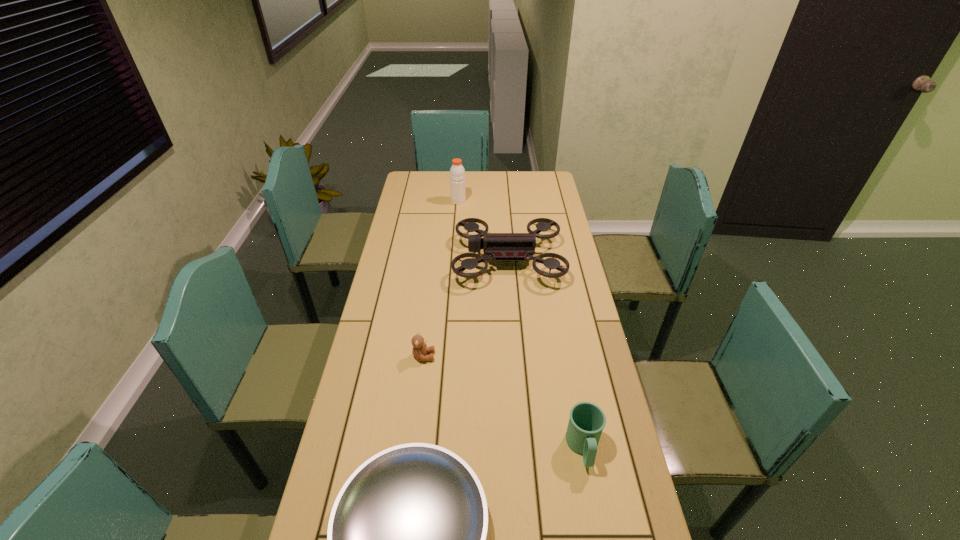
Find the location of a particular element. The height and width of the screenshot is (540, 960). the tallest object is located at coordinates (457, 172).

This screenshot has width=960, height=540. What are the coordinates of `shaker` in the screenshot? It's located at (457, 172).

You are a GUI agent. You are given a task and a screenshot of the screen. Output one action in this format:
    pyautogui.click(x=<x>, y=<y>)
    Task: Click on the drone
    This screenshot has width=960, height=540.
    Given the screenshot: What is the action you would take?
    pyautogui.click(x=508, y=247)

Locate an element on the screen. This screenshot has width=960, height=540. mug is located at coordinates (587, 421).

Locate an element on the screen. teddy bear is located at coordinates (420, 349).

Identify the location of the third nearest object. The image size is (960, 540). (420, 349).

You are a GUI agent. You are given a task and a screenshot of the screen. Output one action in this format:
    pyautogui.click(x=<x>, y=<y>)
    Task: Click on the vacant space positioned 0.290m on the front of the farthest object
    This screenshot has height=540, width=960.
    Given the screenshot: What is the action you would take?
    pyautogui.click(x=456, y=241)

At what (x,y) coordinates should I click in order to perform the action: click on vacant region located on the front-facing side of the drone. Please return your answer as a coordinate pair (x, y). Image resolution: width=960 pixels, height=540 pixels. Looking at the image, I should click on click(434, 260).

Locate an element on the screen. Image resolution: width=960 pixels, height=540 pixels. vacant area situated on the front-facing side of the drone is located at coordinates (409, 260).

At what (x,y) coordinates should I click in order to perform the action: click on vacant space situated on the front-facing side of the drone. Please return your answer as a coordinate pair (x, y). The height and width of the screenshot is (540, 960). Looking at the image, I should click on (423, 260).